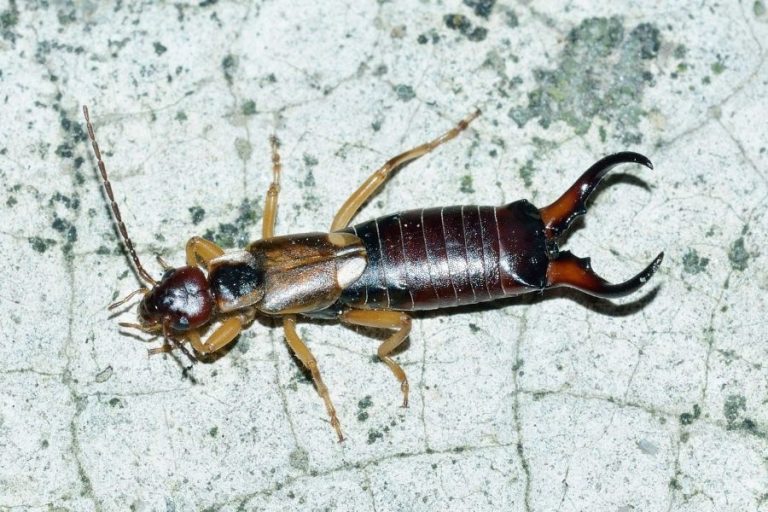
Identify the location of bottom legs. This screenshot has height=512, width=768. (219, 339), (309, 358), (386, 323).